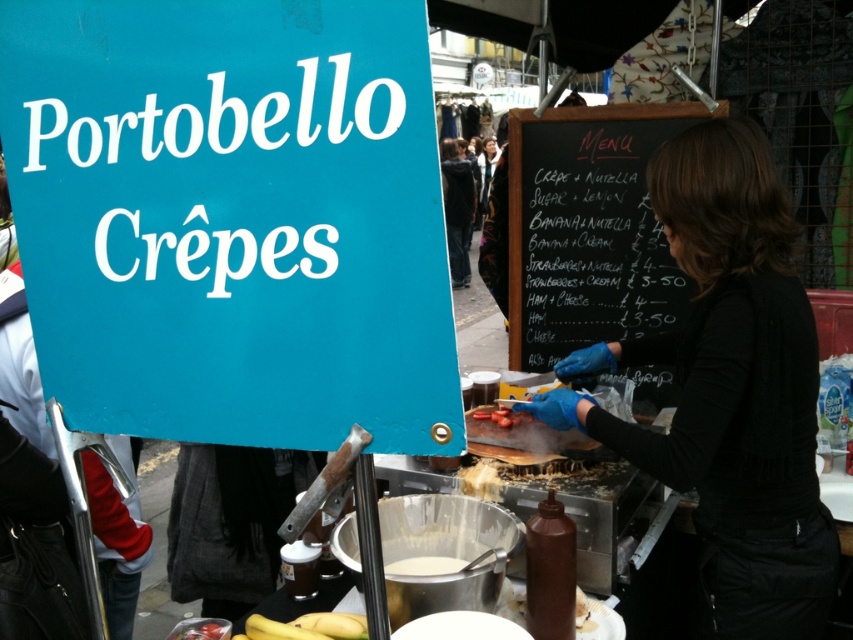
You are a customer at the Portobello Cr?pes stall and want to know which item is bigger between the white matte batter at center and the smooth tomato at center. Which one is larger?

The white matte batter at center is larger in size than the smooth tomato at center.

Please use the coordinates to determine what object is located at point (589,228) in the image. The scene has a crepe stall with a blue sign and a blackboard menu. What object is at that coordinate?

The black chalkboard menu at center is located at point (589,228).